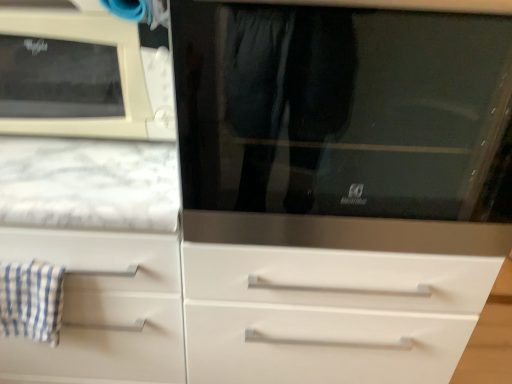
Question: Is the position of beige plastic microwave at upper left more distant than that of blue checkered cloth at left?

Choices:
 (A) yes
 (B) no

Answer: (B)

Question: Does beige plastic microwave at upper left contain blue checkered cloth at left?

Choices:
 (A) yes
 (B) no

Answer: (B)

Question: Is beige plastic microwave at upper left completely or partially outside of blue checkered cloth at left?

Choices:
 (A) no
 (B) yes

Answer: (B)

Question: From a real-world perspective, is beige plastic microwave at upper left beneath blue checkered cloth at left?

Choices:
 (A) yes
 (B) no

Answer: (B)

Question: Does beige plastic microwave at upper left have a lesser width compared to blue checkered cloth at left?

Choices:
 (A) no
 (B) yes

Answer: (A)

Question: Considering the relative sizes of beige plastic microwave at upper left and blue checkered cloth at left in the image provided, is beige plastic microwave at upper left bigger than blue checkered cloth at left?

Choices:
 (A) no
 (B) yes

Answer: (B)

Question: From a real-world perspective, is stainless steel microwave at center located higher than beige plastic microwave at upper left?

Choices:
 (A) yes
 (B) no

Answer: (B)

Question: Is stainless steel microwave at center positioned beyond the bounds of beige plastic microwave at upper left?

Choices:
 (A) no
 (B) yes

Answer: (B)

Question: Does stainless steel microwave at center have a lesser width compared to beige plastic microwave at upper left?

Choices:
 (A) yes
 (B) no

Answer: (B)

Question: Is there a large distance between stainless steel microwave at center and beige plastic microwave at upper left?

Choices:
 (A) no
 (B) yes

Answer: (A)

Question: Is the depth of stainless steel microwave at center less than that of beige plastic microwave at upper left?

Choices:
 (A) no
 (B) yes

Answer: (B)

Question: Considering the relative sizes of stainless steel microwave at center and beige plastic microwave at upper left in the image provided, is stainless steel microwave at center smaller than beige plastic microwave at upper left?

Choices:
 (A) yes
 (B) no

Answer: (B)

Question: Is stainless steel microwave at center closer to camera compared to blue checkered cloth at left?

Choices:
 (A) yes
 (B) no

Answer: (A)